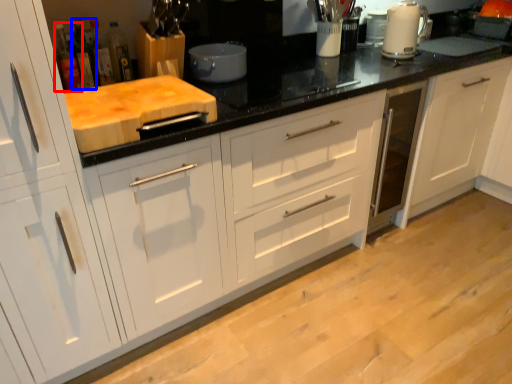
Question: Which of the following is the closest to the observer, bottle (highlighted by a red box) or bottle (highlighted by a blue box)?

Choices:
 (A) bottle
 (B) bottle

Answer: (A)